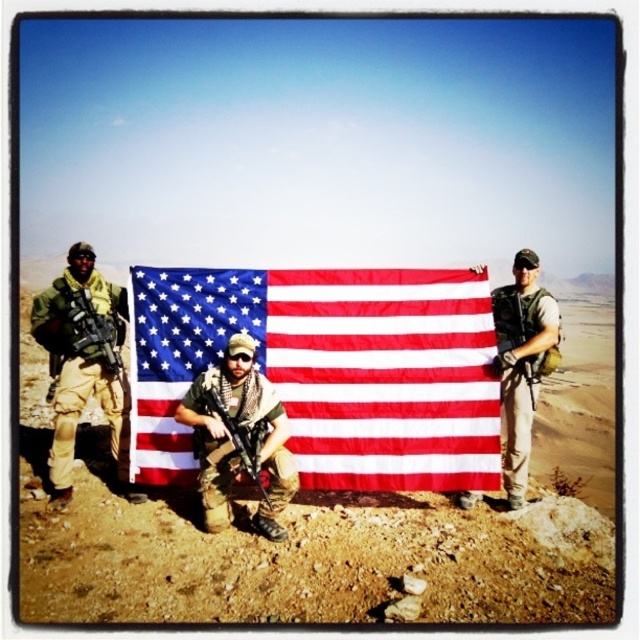
Does red-white striped flag at center appear on the right side of matte black rifle at center?

Correct, you'll find red-white striped flag at center to the right of matte black rifle at center.

Which is more to the left, red-white striped flag at center or matte black rifle at center?

Positioned to the left is matte black rifle at center.

Between point (177, 464) and point (246, 433), which one is positioned behind?

The point (177, 464) is behind.

Find the location of a particular element. This screenshot has width=640, height=640. red-white striped flag at center is located at coordinates (326, 371).

Between camouflage uniform at left and matte black rifle at center, which one is positioned lower?

matte black rifle at center is below.

Based on the photo, is camouflage uniform at left thinner than matte black rifle at center?

Correct, camouflage uniform at left's width is less than matte black rifle at center's.

Which is behind, point (65, 323) or point (250, 476)?

Positioned behind is point (65, 323).

Where is `camouflage uniform at left`? This screenshot has width=640, height=640. camouflage uniform at left is located at coordinates (83, 362).

Based on the photo, does red-white striped flag at center appear on the left side of camouflage uniform at center?

Yes, red-white striped flag at center is to the left of camouflage uniform at center.

Based on the photo, can you confirm if red-white striped flag at center is taller than camouflage uniform at center?

Yes, red-white striped flag at center is taller than camouflage uniform at center.

Is point (481, 324) positioned in front of point (502, 355)?

That is True.

The height and width of the screenshot is (640, 640). What are the coordinates of `red-white striped flag at center` in the screenshot? It's located at (326, 371).